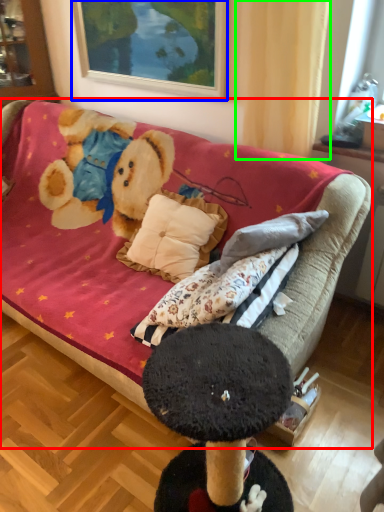
Question: Which object is the farthest from studio couch (highlighted by a red box)? Choose among these: picture frame (highlighted by a blue box) or curtain (highlighted by a green box).

Choices:
 (A) picture frame
 (B) curtain

Answer: (A)